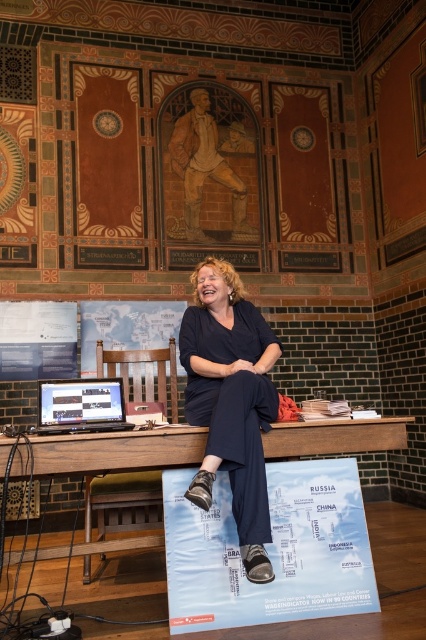
Question: Does dark blue fabric pants at center have a lesser width compared to matte black laptop at center?

Choices:
 (A) yes
 (B) no

Answer: (B)

Question: Observing the image, what is the correct spatial positioning of wooden table at lower center in reference to matte black laptop at center?

Choices:
 (A) above
 (B) below

Answer: (B)

Question: Which object is the farthest from the wooden table at lower center?

Choices:
 (A) matte black laptop at center
 (B) dark blue fabric pants at center

Answer: (B)

Question: Which object is farther from the camera taking this photo?

Choices:
 (A) wooden table at lower center
 (B) dark blue fabric pants at center

Answer: (B)

Question: Considering the relative positions of dark blue fabric pants at center and matte black laptop at center in the image provided, where is dark blue fabric pants at center located with respect to matte black laptop at center?

Choices:
 (A) right
 (B) left

Answer: (A)

Question: Which object is farther from the camera taking this photo?

Choices:
 (A) wooden table at lower center
 (B) matte black laptop at center

Answer: (B)